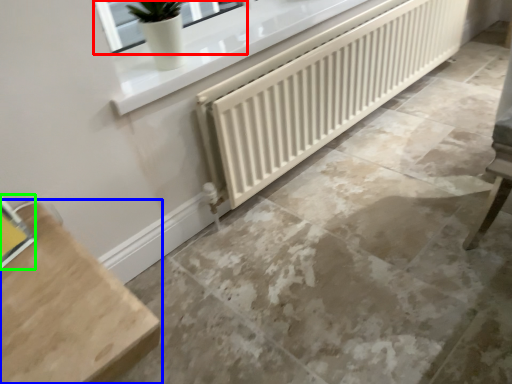
Question: Based on their relative distances, which object is nearer to window (highlighted by a red box)? Choose from furniture (highlighted by a blue box) and window (highlighted by a green box).

Choices:
 (A) furniture
 (B) window

Answer: (B)